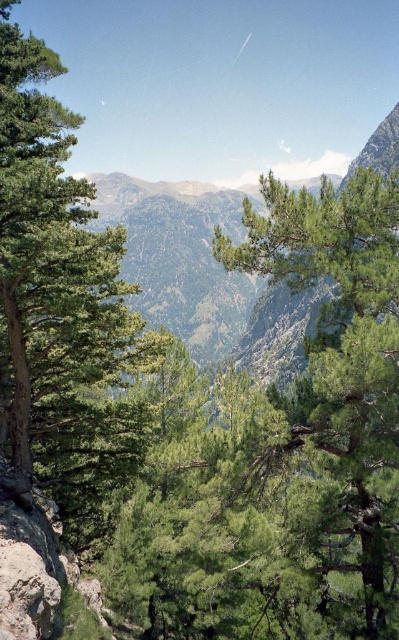
What do you see at coordinates (339, 380) in the screenshot?
I see `green leafy tree at center` at bounding box center [339, 380].

Can you confirm if green leafy tree at center is bigger than green leafy tree at left?

Yes, green leafy tree at center is bigger than green leafy tree at left.

Describe the element at coordinates (339, 380) in the screenshot. I see `green leafy tree at center` at that location.

Identify the location of green leafy tree at center. This screenshot has height=640, width=399. (339, 380).